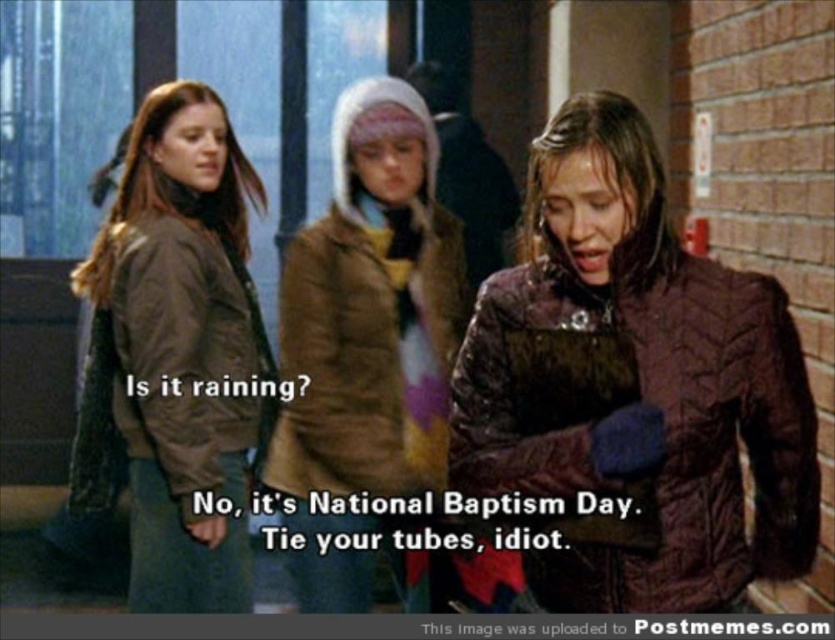
You are trying to decide which coat to wear for a walk. Both the shiny brown jacket at center and the brown quilted coat at center are options. Based on their positions in the image, which one is more visible to you from your current viewpoint?

The shiny brown jacket at center is located above the brown quilted coat at center, so the shiny brown jacket at center is more visible from your current viewpoint.

You are trying to fit both the shiny brown jacket at center and the brown quilted jacket at left into a storage box that can only hold items up to 1 meter in width. Based on their widths, can both jackets fit side by side?

The shiny brown jacket at center might be wider than brown quilted jacket at left. Since the storage box can only hold items up to 1 meter in width, if the combined width of both jackets exceeds 1 meter, they might not fit side by side. However, without exact measurements, it is uncertain.

You are a delivery robot with a 36 inch wide package. You need to pass between the shiny brown jacket at center and the brown quilted coat at center. Can you fit through the space between them?

The distance between the shiny brown jacket at center and the brown quilted coat at center is 35.07 inches. Since the package is 36 inches wide, it is slightly too wide to fit through the space.